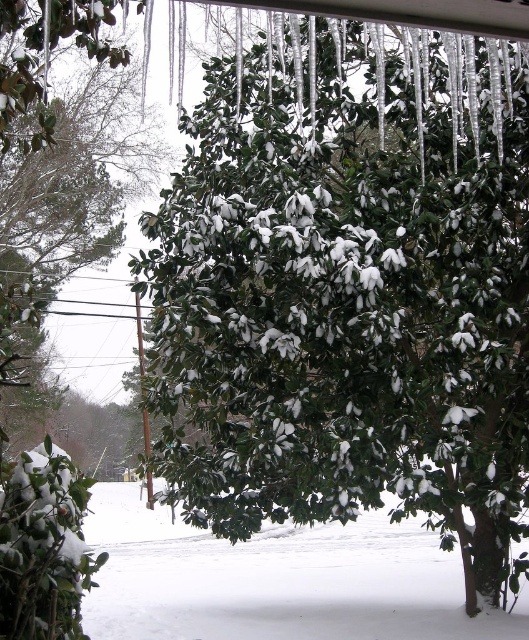
You are standing in the winter scene and notice the green matte tree at center and the green matte leaves at center. Which object is positioned lower in the image?

The green matte tree at center is located below the green matte leaves at center, so it is positioned lower in the image.

You are standing in the winter scene looking at the green matte tree at center and the green matte leaves at center. Which object is closer to you?

The green matte tree at center is closer to you because the green matte leaves at center are positioned behind it.